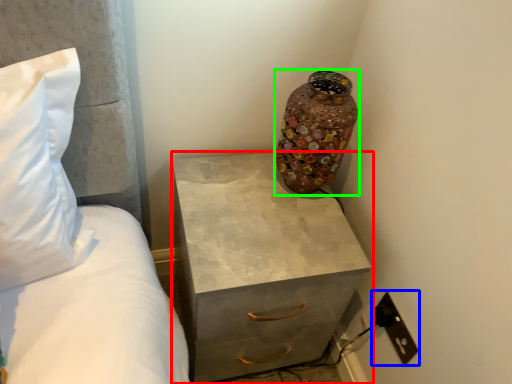
Question: Which object is the closest to the chest of drawers (highlighted by a red box)? Choose among these: electric outlet (highlighted by a blue box) or vase (highlighted by a green box).

Choices:
 (A) electric outlet
 (B) vase

Answer: (B)